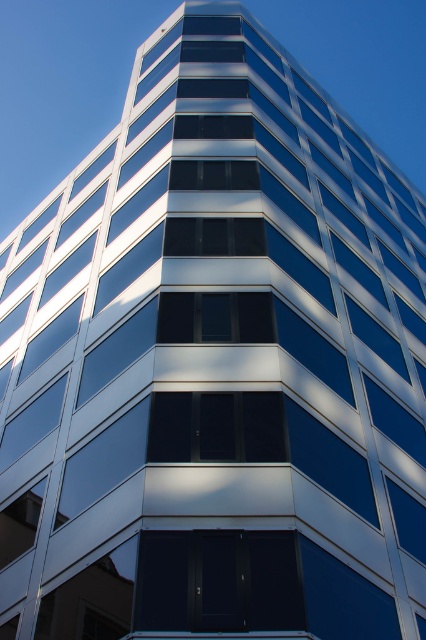
Question: Among these points, which one is farthest from the camera?

Choices:
 (A) click(x=273, y=580)
 (B) click(x=264, y=444)

Answer: (B)

Question: Among these points, which one is nearest to the camera?

Choices:
 (A) (178, 444)
 (B) (146, 548)

Answer: (B)

Question: Is dark glass door at center smaller than black glass window at center?

Choices:
 (A) yes
 (B) no

Answer: (B)

Question: Among these points, which one is farthest from the camera?

Choices:
 (A) (138, 573)
 (B) (198, 419)

Answer: (B)

Question: Where is dark glass door at center located in relation to black glass window at center in the image?

Choices:
 (A) below
 (B) above

Answer: (A)

Question: Is dark glass door at center further to the viewer compared to black glass window at center?

Choices:
 (A) yes
 (B) no

Answer: (B)